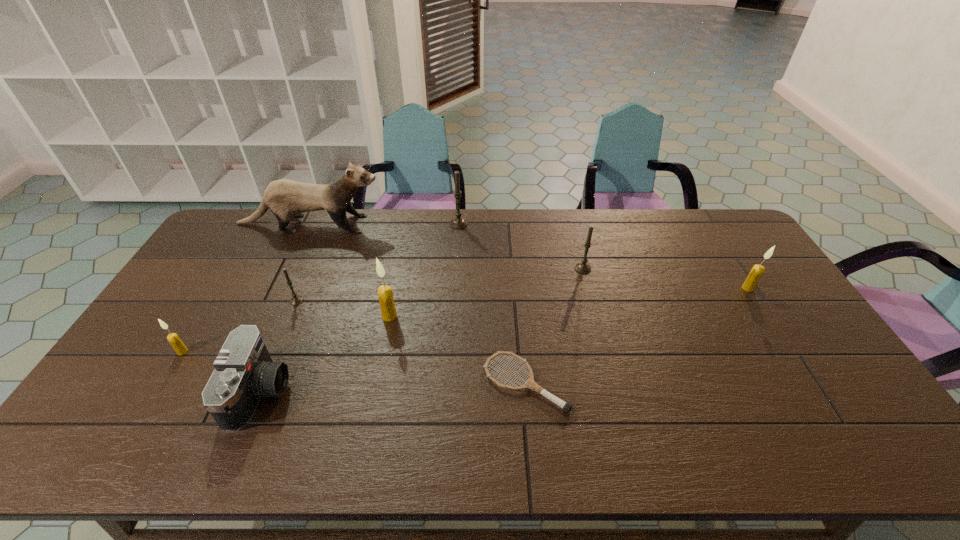
Find the location of a particular element. The height and width of the screenshot is (540, 960). ferret is located at coordinates (285, 198).

The width and height of the screenshot is (960, 540). What are the coordinates of `the farthest candle` in the screenshot? It's located at (458, 223).

Image resolution: width=960 pixels, height=540 pixels. In order to click on the fourth object from right to left in this screenshot , I will do `click(458, 223)`.

Image resolution: width=960 pixels, height=540 pixels. I want to click on the third candle from left to right, so click(x=385, y=295).

Locate an element on the screen. The image size is (960, 540). the second nearest cream candle is located at coordinates (385, 295).

This screenshot has height=540, width=960. In order to click on the third farthest object in this screenshot , I will do `click(583, 268)`.

Locate an element on the screen. The height and width of the screenshot is (540, 960). the second biggest gray candle is located at coordinates (583, 268).

You are a GUI agent. You are given a task and a screenshot of the screen. Output one action in this format:
    pyautogui.click(x=<x>, y=<y>)
    Task: Click on the second biggest cream candle
    This screenshot has width=960, height=540.
    Given the screenshot: What is the action you would take?
    pyautogui.click(x=756, y=272)

This screenshot has height=540, width=960. Identify the location of the farthest cream candle. (756, 272).

The height and width of the screenshot is (540, 960). What are the coordinates of `the smallest gray candle` in the screenshot? It's located at (296, 299).